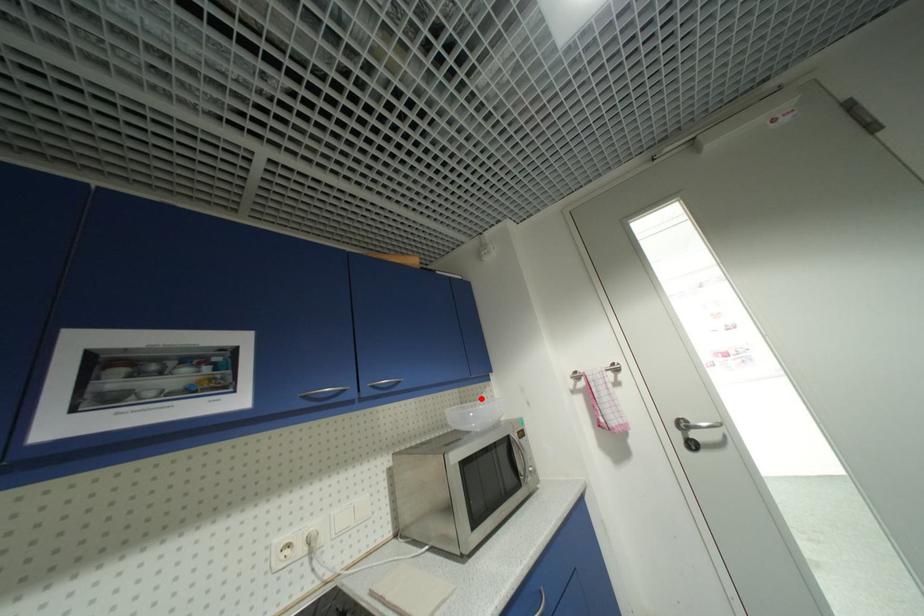
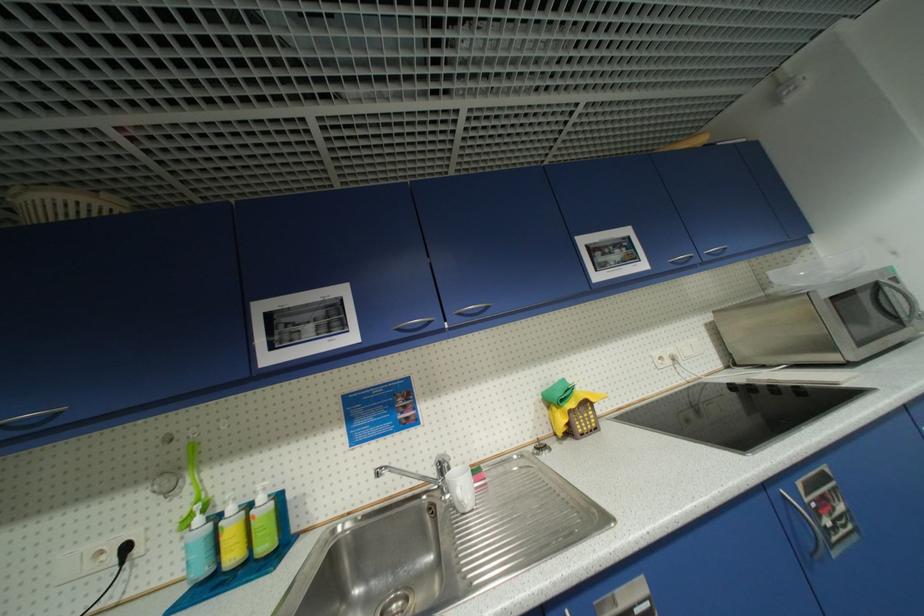
Where in the second image is the point corresponding to the highlighted location from the first image?

(793, 265)